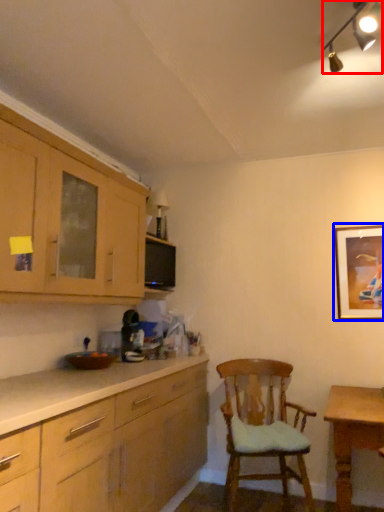
Question: Which of the following is the farthest to the observer, light fixture (highlighted by a red box) or picture frame (highlighted by a blue box)?

Choices:
 (A) light fixture
 (B) picture frame

Answer: (B)